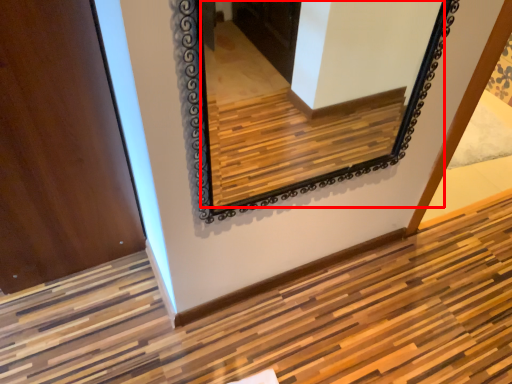
Question: From the image's perspective, where is mirror (annotated by the red box) located in relation to door in the image?

Choices:
 (A) below
 (B) above

Answer: (A)